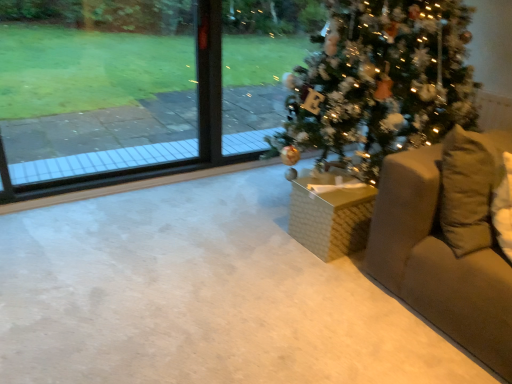
Question: Is shiny green christmas tree at center positioned beyond the bounds of white woven basket at center, the first furniture from the left?

Choices:
 (A) yes
 (B) no

Answer: (A)

Question: Can you confirm if shiny green christmas tree at center is positioned to the right of white woven basket at center, the 2th furniture from the right?

Choices:
 (A) yes
 (B) no

Answer: (A)

Question: Does shiny green christmas tree at center have a larger size compared to white woven basket at center, the 2th furniture from the right?

Choices:
 (A) no
 (B) yes

Answer: (B)

Question: From the image's perspective, is shiny green christmas tree at center over white woven basket at center, the 2th furniture from the right?

Choices:
 (A) yes
 (B) no

Answer: (A)

Question: Can you confirm if shiny green christmas tree at center is wider than white woven basket at center, the 2th furniture from the right?

Choices:
 (A) no
 (B) yes

Answer: (B)

Question: Is white woven basket at center, the first furniture from the left, completely or partially inside shiny green christmas tree at center?

Choices:
 (A) yes
 (B) no

Answer: (A)

Question: Considering the relative sizes of white woven basket at center, the 2th furniture from the right, and beige fabric couch at right, the 2th furniture positioned from the left, in the image provided, is white woven basket at center, the 2th furniture from the right, shorter than beige fabric couch at right, the 2th furniture positioned from the left,?

Choices:
 (A) no
 (B) yes

Answer: (B)

Question: Is the depth of white woven basket at center, the first furniture from the left, less than that of beige fabric couch at right, the first furniture viewed from the right?

Choices:
 (A) no
 (B) yes

Answer: (A)

Question: From the image's perspective, is white woven basket at center, the first furniture from the left, above beige fabric couch at right, the first furniture viewed from the right?

Choices:
 (A) yes
 (B) no

Answer: (B)

Question: Can you confirm if white woven basket at center, the 2th furniture from the right, is bigger than beige fabric couch at right, the 2th furniture positioned from the left?

Choices:
 (A) yes
 (B) no

Answer: (B)

Question: From the image's perspective, would you say white woven basket at center, the first furniture from the left, is shown under beige fabric couch at right, the first furniture viewed from the right?

Choices:
 (A) yes
 (B) no

Answer: (A)

Question: Could beige fabric couch at right, the 2th furniture positioned from the left, be considered to be inside white woven basket at center, the 2th furniture from the right?

Choices:
 (A) no
 (B) yes

Answer: (A)

Question: Is beige fabric couch at right, the 2th furniture positioned from the left, to the right of transparent glass window at upper left from the viewer's perspective?

Choices:
 (A) yes
 (B) no

Answer: (A)